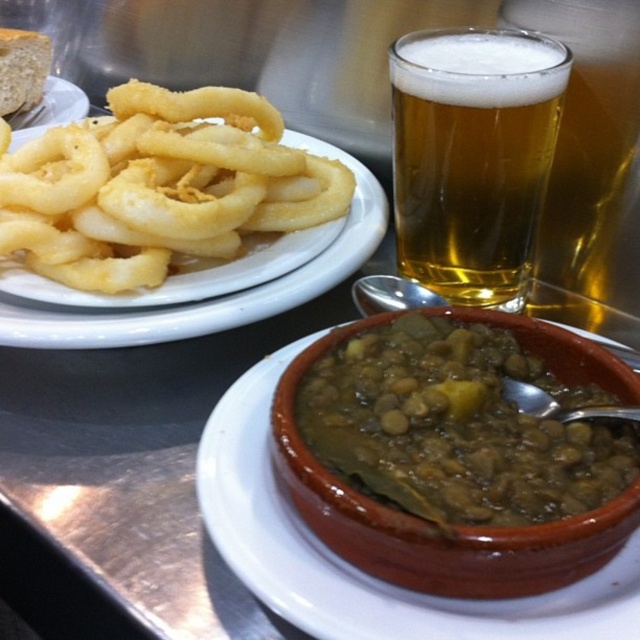
Question: Which of the following is the closest to the observer?

Choices:
 (A) green matte stew at center
 (B) golden fried calamari at left
 (C) golden amber liquid at upper right

Answer: (A)

Question: Can you confirm if golden amber liquid at upper right is smaller than golden fried calamari at left?

Choices:
 (A) yes
 (B) no

Answer: (A)

Question: Estimate the real-world distances between objects in this image. Which object is closer to the golden fried calamari at left?

Choices:
 (A) golden amber liquid at upper right
 (B) green matte stew at center

Answer: (A)

Question: Can you confirm if green matte stew at center is positioned above golden amber liquid at upper right?

Choices:
 (A) yes
 (B) no

Answer: (B)

Question: Does golden amber liquid at upper right appear on the left side of golden fried calamari at left?

Choices:
 (A) yes
 (B) no

Answer: (B)

Question: Which point is closer to the camera?

Choices:
 (A) (515, 467)
 (B) (163, 340)
 (C) (465, 166)

Answer: (A)